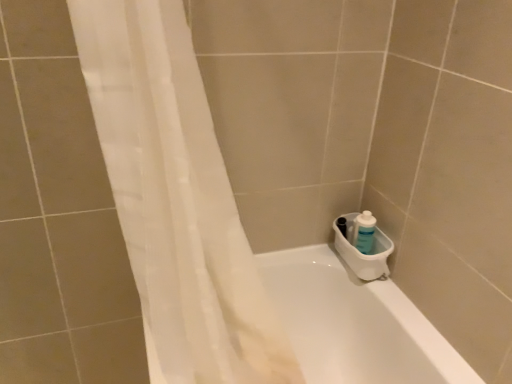
Where is `white sheer curtain at left`? white sheer curtain at left is located at coordinates (176, 198).

In order to click on blue plastic bottle at right in this screenshot , I will do `click(364, 231)`.

This screenshot has height=384, width=512. What are the coordinates of `white sheer curtain at left` in the screenshot? It's located at (176, 198).

Is white glossy bathtub at lower right taller or shorter than blue plastic bottle at right?

Considering their sizes, white glossy bathtub at lower right has more height than blue plastic bottle at right.

From a real-world perspective, who is located higher, white glossy bathtub at lower right or blue plastic bottle at right?

In real-world perspective, blue plastic bottle at right is above.

Where is `cleaning product lying above the white glossy bathtub at lower right (from the image's perspective)`? This screenshot has width=512, height=384. cleaning product lying above the white glossy bathtub at lower right (from the image's perspective) is located at coordinates (364, 231).

Is white glossy bathtub at lower right wider than blue plastic bottle at right?

Correct, the width of white glossy bathtub at lower right exceeds that of blue plastic bottle at right.

Find the location of a particular element. The width and height of the screenshot is (512, 384). sink located behind the white glossy bathtub at lower right is located at coordinates (365, 255).

Is point (351, 364) farther from camera compared to point (365, 265)?

Yes, it is.

Can you confirm if white glossy bathtub at lower right is positioned to the left of white plastic sink at lower right?

Yes, white glossy bathtub at lower right is to the left of white plastic sink at lower right.

Does white glossy bathtub at lower right have a greater height compared to white plastic sink at lower right?

Correct, white glossy bathtub at lower right is much taller as white plastic sink at lower right.

How many degrees apart are the facing directions of blue plastic bottle at right and white glossy bathtub at lower right?

There is a 0.534-degree angle between the facing directions of blue plastic bottle at right and white glossy bathtub at lower right.

Where is `bathtub on the left of blue plastic bottle at right`? bathtub on the left of blue plastic bottle at right is located at coordinates (354, 324).

In the scene shown: Does blue plastic bottle at right appear on the right side of white glossy bathtub at lower right?

Indeed, blue plastic bottle at right is positioned on the right side of white glossy bathtub at lower right.

Considering the points (358, 216) and (340, 292), which point is in front, point (358, 216) or point (340, 292)?

The point (358, 216) is more forward.

In terms of width, does white sheer curtain at left look wider or thinner when compared to white glossy bathtub at lower right?

In the image, white sheer curtain at left appears to be more narrow than white glossy bathtub at lower right.

Does white sheer curtain at left contain white glossy bathtub at lower right?

No.

Locate an element on the screen. This screenshot has height=384, width=512. shower curtain above the white glossy bathtub at lower right (from a real-world perspective) is located at coordinates (176, 198).

Which object is more forward, blue plastic bottle at right or white sheer curtain at left?

Positioned in front is white sheer curtain at left.

Which is more to the right, blue plastic bottle at right or white sheer curtain at left?

blue plastic bottle at right.

Measure the distance from blue plastic bottle at right to white sheer curtain at left.

blue plastic bottle at right is 24.46 inches away from white sheer curtain at left.

Is blue plastic bottle at right positioned far away from white plastic sink at lower right?

No.

Could you tell me if blue plastic bottle at right is facing white plastic sink at lower right?

Yes.

From a real-world perspective, is blue plastic bottle at right positioned above or below white plastic sink at lower right?

In terms of real-world spatial position, blue plastic bottle at right is above white plastic sink at lower right.

Can you confirm if blue plastic bottle at right is wider than white plastic sink at lower right?

In fact, blue plastic bottle at right might be narrower than white plastic sink at lower right.

Between white glossy bathtub at lower right and white sheer curtain at left, which one has more height?

Standing taller between the two is white sheer curtain at left.

Locate an element on the screen. The width and height of the screenshot is (512, 384). bathtub below the white sheer curtain at left (from the image's perspective) is located at coordinates (354, 324).

Is white glossy bathtub at lower right completely or partially outside of white sheer curtain at left?

Yes.

Is white glossy bathtub at lower right oriented away from white sheer curtain at left?

No, white glossy bathtub at lower right is not facing away from white sheer curtain at left.

Image resolution: width=512 pixels, height=384 pixels. What are the coordinates of `cleaning product above the white glossy bathtub at lower right (from a real-world perspective)` in the screenshot? It's located at (364, 231).

Where is `bathtub on the left side of white plastic sink at lower right`? The height and width of the screenshot is (384, 512). bathtub on the left side of white plastic sink at lower right is located at coordinates (354, 324).

Looking at the image, which one is located further to white sheer curtain at left, blue plastic bottle at right or white plastic sink at lower right?

blue plastic bottle at right.

From the image, which object appears to be farther from white glossy bathtub at lower right, white plastic sink at lower right or blue plastic bottle at right?

blue plastic bottle at right.

When comparing their distances from white plastic sink at lower right, does blue plastic bottle at right or white glossy bathtub at lower right seem further?

white glossy bathtub at lower right.

Considering their positions, is white plastic sink at lower right positioned further to white sheer curtain at left than white glossy bathtub at lower right?

The object further to white sheer curtain at left is white plastic sink at lower right.

Considering their positions, is white glossy bathtub at lower right positioned closer to white plastic sink at lower right than blue plastic bottle at right?

blue plastic bottle at right.

Which object lies nearer to the anchor point white glossy bathtub at lower right, blue plastic bottle at right or white plastic sink at lower right?

The object closer to white glossy bathtub at lower right is white plastic sink at lower right.

Estimate the real-world distances between objects in this image. Which object is closer to white plastic sink at lower right, white sheer curtain at left or white glossy bathtub at lower right?

Among the two, white glossy bathtub at lower right is located nearer to white plastic sink at lower right.

Looking at the image, which one is located closer to white glossy bathtub at lower right, white plastic sink at lower right or white sheer curtain at left?

The object closer to white glossy bathtub at lower right is white plastic sink at lower right.

Where is `sink between white sheer curtain at left and blue plastic bottle at right from front to back`? This screenshot has width=512, height=384. sink between white sheer curtain at left and blue plastic bottle at right from front to back is located at coordinates (365, 255).

The image size is (512, 384). In order to click on bathtub between white sheer curtain at left and blue plastic bottle at right from front to back in this screenshot , I will do pos(354,324).

The image size is (512, 384). What are the coordinates of `sink located between white glossy bathtub at lower right and blue plastic bottle at right in the depth direction` in the screenshot? It's located at (365, 255).

The width and height of the screenshot is (512, 384). I want to click on bathtub between white sheer curtain at left and white plastic sink at lower right from front to back, so click(x=354, y=324).